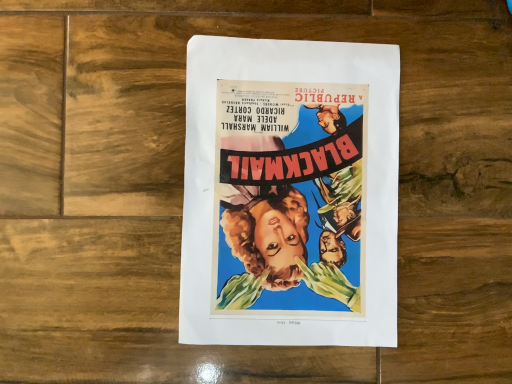
Image resolution: width=512 pixels, height=384 pixels. In order to click on free spot above matte paper poster at center (from a real-world perspective) in this screenshot , I will do `click(295, 193)`.